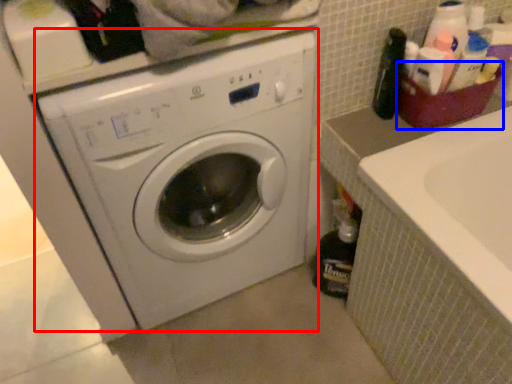
Question: Which of the following is the closest to the observer, washing machine (highlighted by a red box) or basket (highlighted by a blue box)?

Choices:
 (A) washing machine
 (B) basket

Answer: (A)